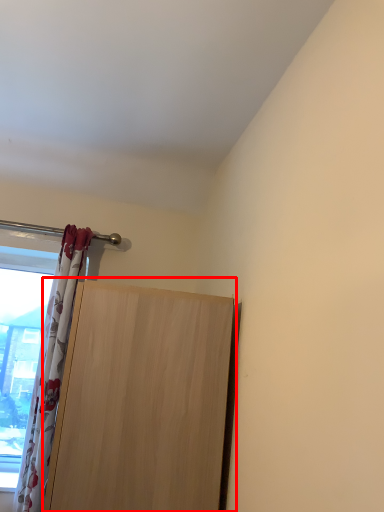
Question: From the image's perspective, where is door (annotated by the red box) located relative to curtain?

Choices:
 (A) above
 (B) below

Answer: (B)